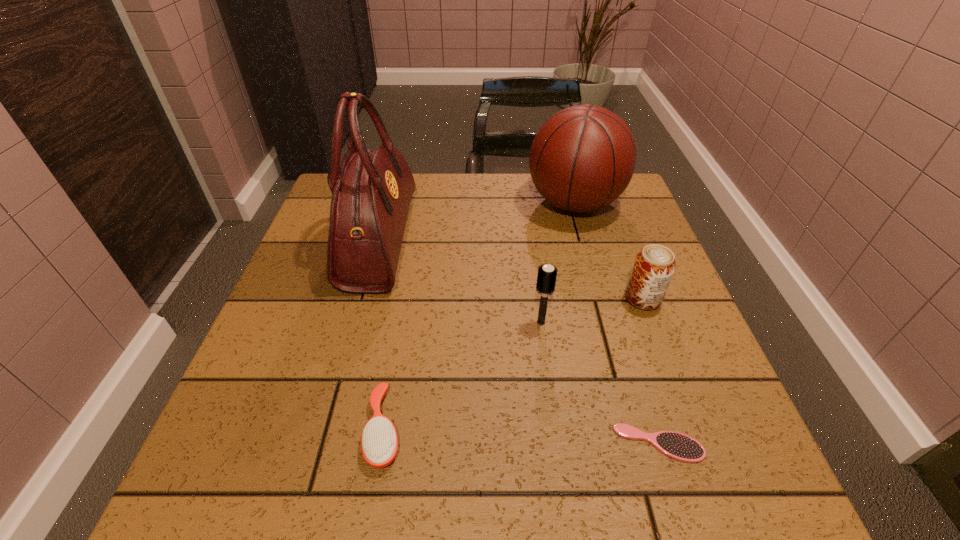
This screenshot has width=960, height=540. I want to click on the fourth closest object to the leftmost hairbrush, so click(654, 266).

Locate which object is the fourth closest to the tallest hairbrush. Please provide its 2D coordinates. Your answer should be formatted as a tuple, i.e. [(x, y)], where the tuple contains the x and y coordinates of a point satisfying the conditions above.

[(582, 159)]

Locate which hairbrush ranks in proximity to the handbag. Please provide its 2D coordinates. Your answer should be formatted as a tuple, i.e. [(x, y)], where the tuple contains the x and y coordinates of a point satisfying the conditions above.

[(379, 442)]

I want to click on the second closest hairbrush to the basketball, so click(x=379, y=442).

Locate an element on the screen. vacant region that satisfies the following two spatial constraints: 1. on the front-facing side of the farthest hairbrush; 2. on the right side of the handbag is located at coordinates (358, 322).

Where is `vacant space that satisfies the following two spatial constraints: 1. on the front-facing side of the third shortest object; 2. on the right side of the tallest object`? The image size is (960, 540). vacant space that satisfies the following two spatial constraints: 1. on the front-facing side of the third shortest object; 2. on the right side of the tallest object is located at coordinates (364, 299).

Locate an element on the screen. The width and height of the screenshot is (960, 540). vacant area that satisfies the following two spatial constraints: 1. on the front-facing side of the tallest object; 2. on the left side of the fourth tallest object is located at coordinates (364, 299).

Image resolution: width=960 pixels, height=540 pixels. What are the coordinates of `vacant space that satisfies the following two spatial constraints: 1. on the back side of the shortest object; 2. on the front-facing side of the handbag` in the screenshot? It's located at (596, 240).

I want to click on free space that satisfies the following two spatial constraints: 1. on the front-facing side of the handbag; 2. on the back side of the third nearest object, so click(358, 322).